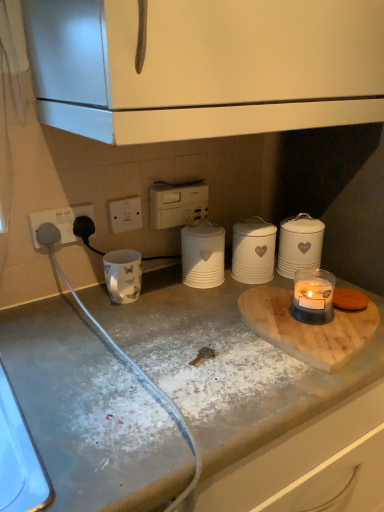
The width and height of the screenshot is (384, 512). What are the coordinates of `space that is in front of white matte canister at center, which ranks as the 1th kitchen appliance in left-to-right order` in the screenshot? It's located at (220, 310).